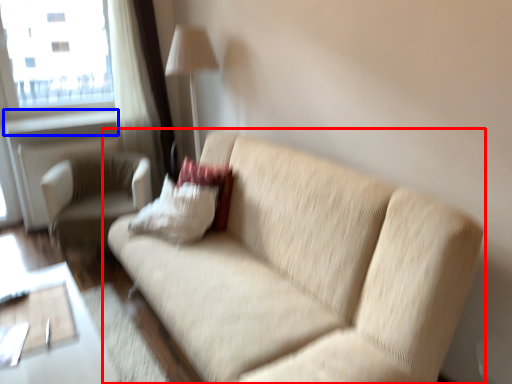
Question: Which object appears farthest to the camera in this image, studio couch (highlighted by a red box) or window sill (highlighted by a blue box)?

Choices:
 (A) studio couch
 (B) window sill

Answer: (B)